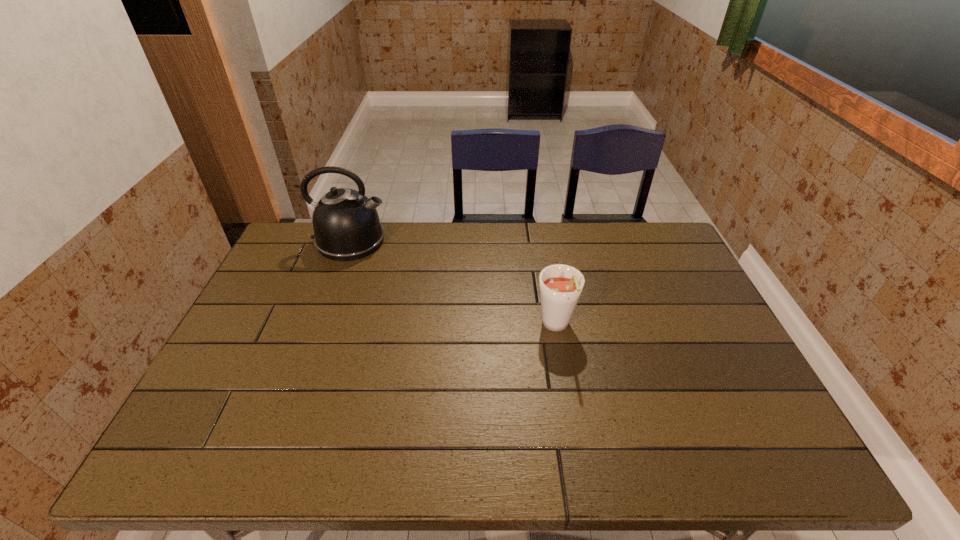
The width and height of the screenshot is (960, 540). Find the location of `the taller object`. the taller object is located at coordinates (346, 224).

At what (x,y) coordinates should I click in order to perform the action: click on the left object. Please return your answer as a coordinate pair (x, y). The width and height of the screenshot is (960, 540). Looking at the image, I should click on (346, 224).

Where is `the nearer object`? the nearer object is located at coordinates coord(561,285).

Locate an element on the screen. The width and height of the screenshot is (960, 540). root beer is located at coordinates (561, 285).

You are a GUI agent. You are given a task and a screenshot of the screen. Output one action in this format:
    pyautogui.click(x=<x>, y=<y>)
    Task: Click on the vacant space located on the spout of the kettle
    The height and width of the screenshot is (540, 960).
    Given the screenshot: What is the action you would take?
    pyautogui.click(x=441, y=241)

In order to click on vacant space located 0.260m on the drink side of the root beer in this screenshot , I will do `click(576, 440)`.

The height and width of the screenshot is (540, 960). Find the location of `object at the far edge`. object at the far edge is located at coordinates (346, 224).

Locate an element on the screen. The width and height of the screenshot is (960, 540). object located at the left edge is located at coordinates (346, 224).

This screenshot has width=960, height=540. Identify the location of object present at the far left corner. (346, 224).

Find the location of a particular element. This screenshot has width=960, height=540. free spot at the far edge of the desktop is located at coordinates (449, 259).